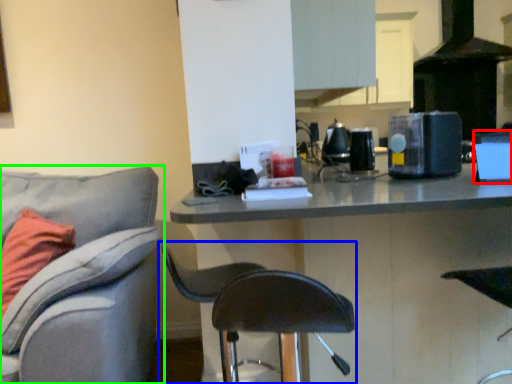
Question: Based on their relative distances, which object is farther from appliance (highlighted by a red box)? Choose from chair (highlighted by a blue box) and chair (highlighted by a green box).

Choices:
 (A) chair
 (B) chair

Answer: (B)